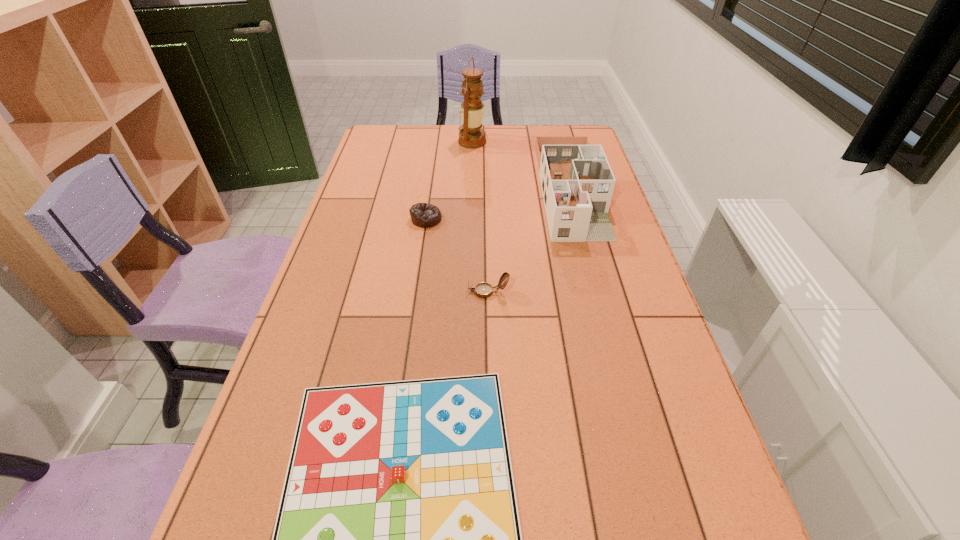
Locate an element on the screen. empty space between the compass and the tallest object is located at coordinates (480, 217).

You are a GUI agent. You are given a task and a screenshot of the screen. Output one action in this format:
    pyautogui.click(x=<x>, y=<y>)
    Task: Click on the unoccupied position between the third tallest object and the fourth tallest object
    
    Given the screenshot: What is the action you would take?
    pyautogui.click(x=457, y=255)

Find the location of a particular element. free area in between the second tallest object and the second shortest object is located at coordinates (498, 205).

Locate an element on the screen. vacant region between the second shortest object and the dollhouse is located at coordinates (498, 205).

This screenshot has height=540, width=960. Find the location of `free space between the beanbag and the second nearest object`. free space between the beanbag and the second nearest object is located at coordinates (457, 255).

This screenshot has width=960, height=540. What are the coordinates of `vacant area that lies between the rightmost object and the tallest object` in the screenshot? It's located at (521, 166).

Select which object is the closest to the tallest object. Please provide its 2D coordinates. Your answer should be formatted as a tuple, i.e. [(x, y)], where the tuple contains the x and y coordinates of a point satisfying the conditions above.

[(577, 183)]

Where is `the third closest object to the second nearest object`? This screenshot has width=960, height=540. the third closest object to the second nearest object is located at coordinates click(x=423, y=215).

The height and width of the screenshot is (540, 960). What are the coordinates of `free location that satisfies the following two spatial constraints: 1. on the back side of the beanbag; 2. on the right side of the tallest object` in the screenshot? It's located at (438, 141).

Find the location of a particular element. This screenshot has width=960, height=540. vacant position in the image that satisfies the following two spatial constraints: 1. on the back side of the tallest object; 2. on the left side of the beanbag is located at coordinates (x=438, y=141).